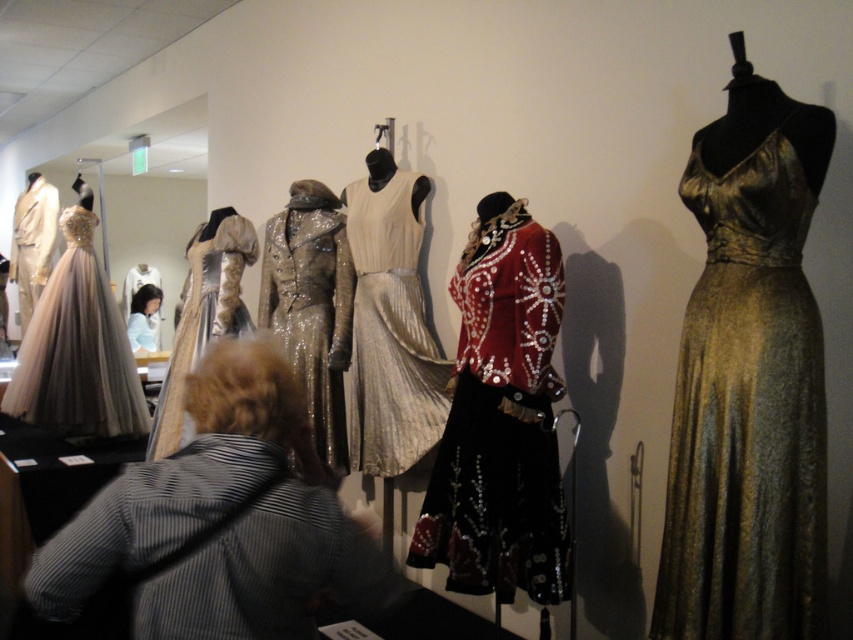
What do you see at coordinates (749, 403) in the screenshot? I see `gold satin dress at right` at bounding box center [749, 403].

Can you confirm if gold satin dress at right is smaller than matte gold gown at left?

Correct, gold satin dress at right occupies less space than matte gold gown at left.

Where is `gold satin dress at right`? The width and height of the screenshot is (853, 640). gold satin dress at right is located at coordinates (749, 403).

Can you confirm if gold satin dress at right is thinner than satin dress at center?

Indeed, gold satin dress at right has a lesser width compared to satin dress at center.

Is point (747, 625) positioned in front of point (364, 420)?

Yes, point (747, 625) is closer to viewer.

Image resolution: width=853 pixels, height=640 pixels. I want to click on gold satin dress at right, so click(x=749, y=403).

Is gold satin dress at right thinner than silvery metallic gown at center?

Yes.

Does point (729, 440) come in front of point (178, 330)?

Yes.

You are a GUI agent. You are given a task and a screenshot of the screen. Output one action in this format:
    pyautogui.click(x=<x>, y=<y>)
    Task: Click on the gold satin dress at right
    This screenshot has height=640, width=853.
    Given the screenshot: What is the action you would take?
    pyautogui.click(x=749, y=403)